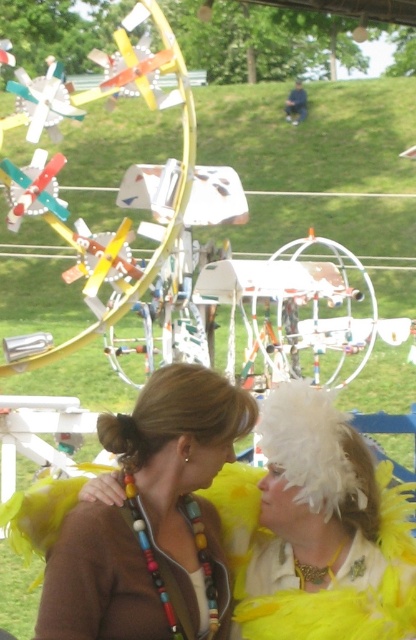
You are a photographer taking a picture of the two women in the scene. You notice a point at coordinates (151,520). Based on the scene description, where is this point located?

The point at coordinates (151,520) is located on the brown beaded necklace at center.

You are a photographer trying to capture a closeup shot of both the brown beaded necklace at center and the brown hair bun at center. Since the camera lens can only focus on one object at a time, which object should you choose to ensure it appears larger in the photo?

The brown beaded necklace at center is larger in width than the brown hair bun at center, so to capture a larger image, focus on the brown beaded necklace at center.

You are a photographer trying to capture the perfect shot of the brown beaded necklace at center. According to the coordinates provided, where exactly should you position your camera to focus on it?

The brown beaded necklace at center is located at the 2D coordinates point (151, 520), so you should position your camera to focus precisely on that coordinate point to capture it.